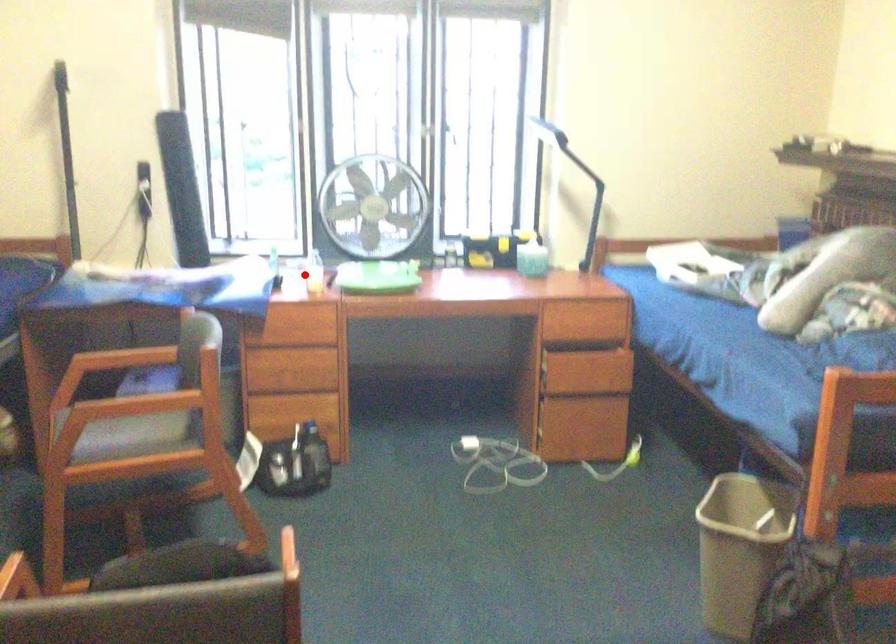
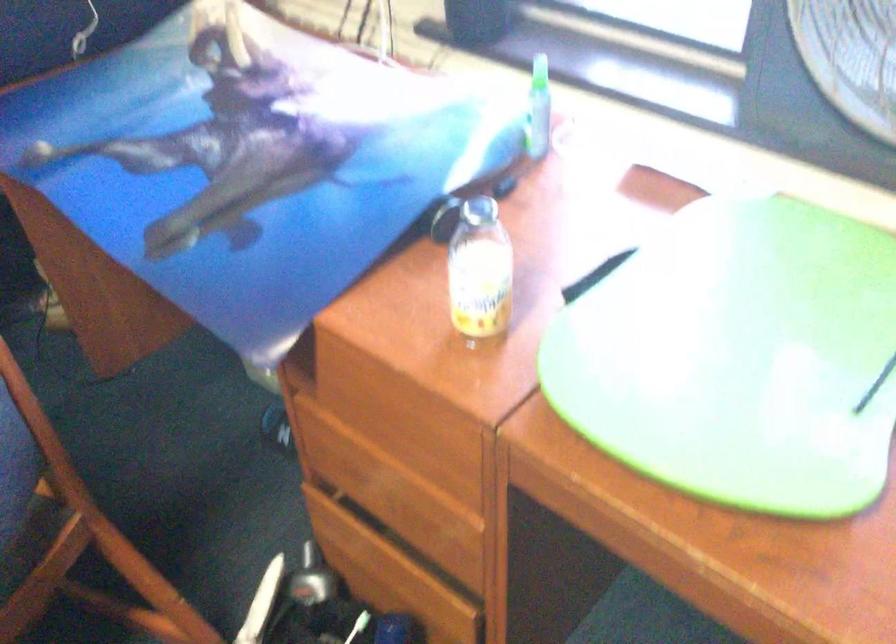
Question: I am providing you with two images of the same scene from different viewpoints. A red point is shown in image1. For the corresponding object point in image2, is it positioned nearer or farther from the camera?

Choices:
 (A) Nearer
 (B) Farther

Answer: (A)